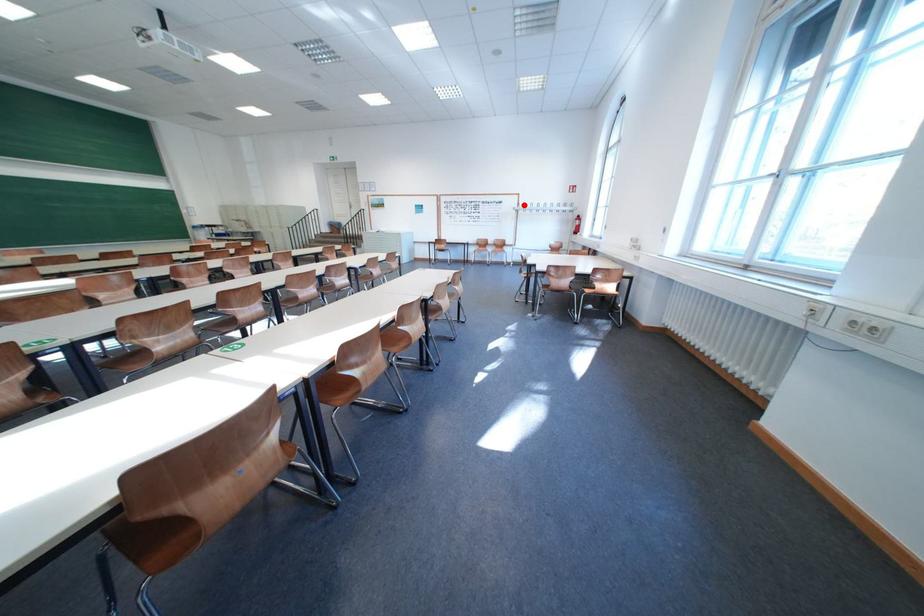
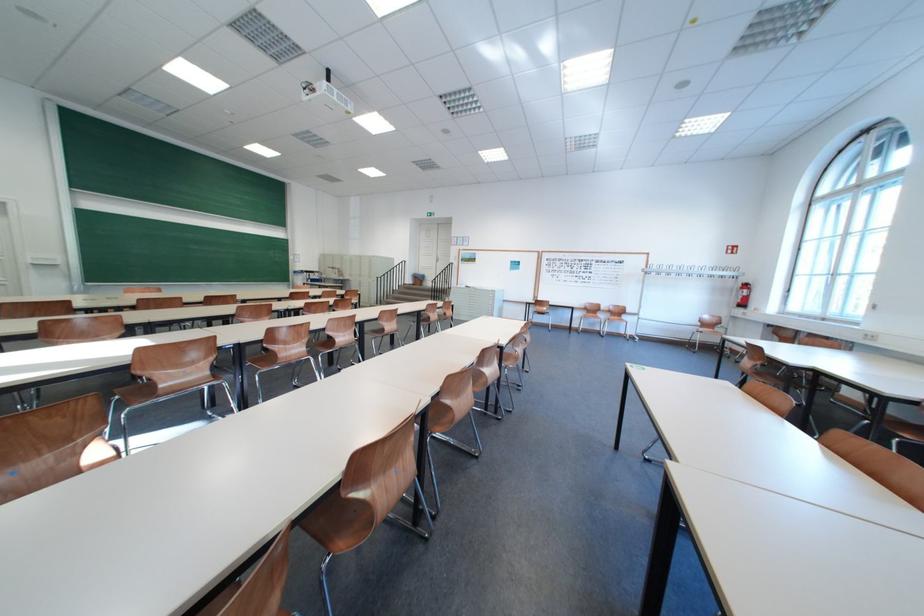
Question: A red point is marked in image1. In image2, is the corresponding 3D point closer to the camera or farther? Reply with the corresponding letter.

Choices:
 (A) The corresponding 3D point is closer.
 (B) The corresponding 3D point is farther.

Answer: (B)